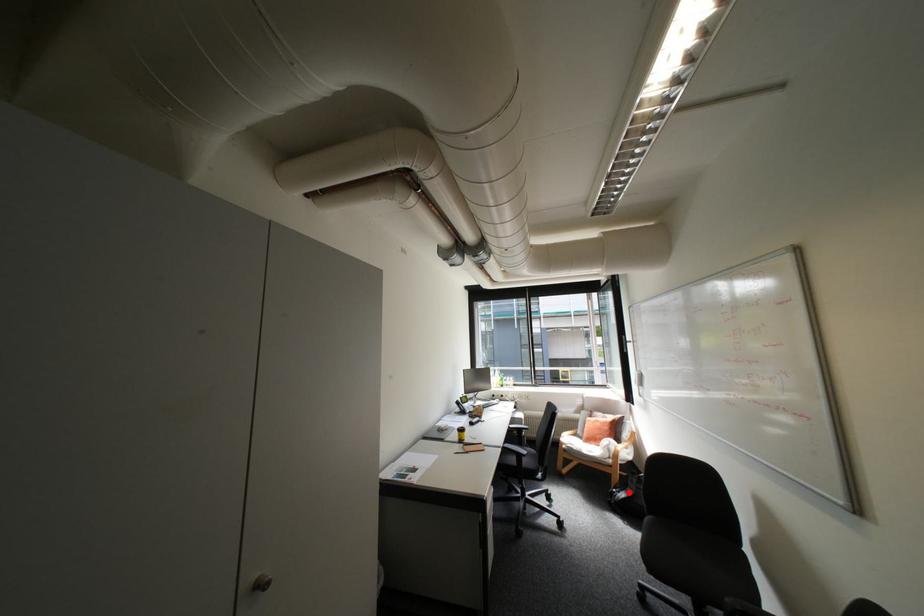
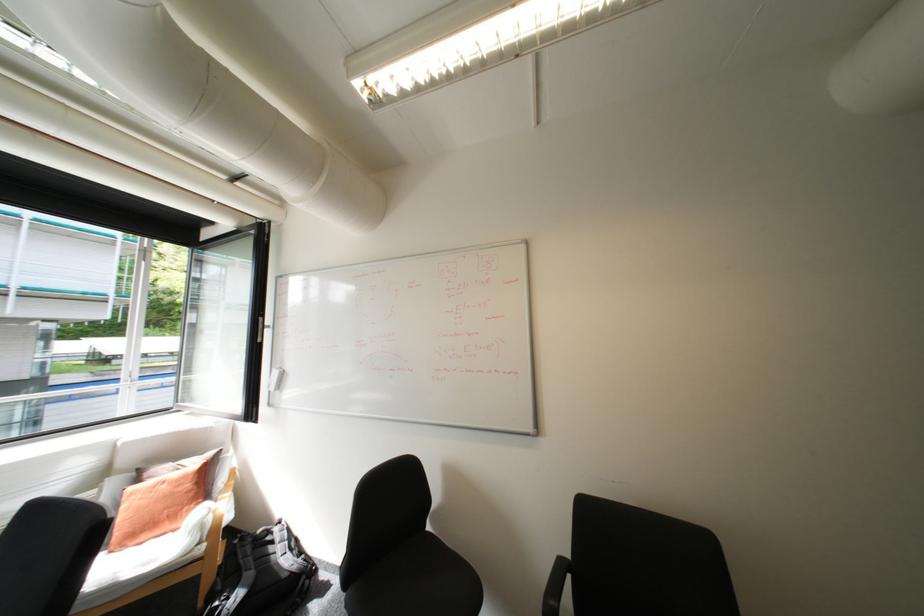
Question: I am providing you with two images of the same scene from different viewpoints. A red point is marked on the first image. Is the red point's position out of view in image 2?

Choices:
 (A) Yes
 (B) No

Answer: (B)